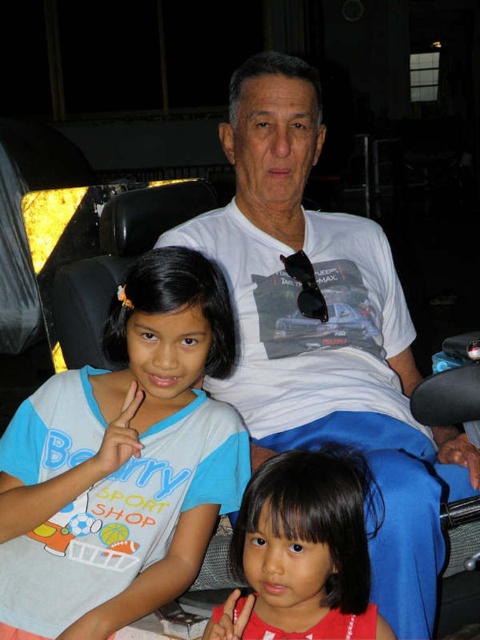
Can you confirm if white cotton t-shirt at center is smaller than blue cotton shirt at left?

No.

Who is lower down, white cotton t-shirt at center or blue cotton shirt at left?

Positioned lower is blue cotton shirt at left.

Who is more distant from viewer, (277, 440) or (159, 349)?

Point (277, 440)

Image resolution: width=480 pixels, height=640 pixels. Find the location of `white cotton t-shirt at center`. white cotton t-shirt at center is located at coordinates (326, 332).

Can you confirm if white cotton t-shirt at center is thinner than smooth red shirt at lower center?

No, white cotton t-shirt at center is not thinner than smooth red shirt at lower center.

Does point (373, 349) lie in front of point (243, 625)?

No, (373, 349) is further to viewer.

Locate an element on the screen. The height and width of the screenshot is (640, 480). white cotton t-shirt at center is located at coordinates click(x=326, y=332).

What are the coordinates of `blue cotton shirt at left` in the screenshot? It's located at (123, 461).

Measure the distance from blue cotton shirt at left to smooth red shirt at lower center.

A distance of 30.21 centimeters exists between blue cotton shirt at left and smooth red shirt at lower center.

Who is more forward, (168, 317) or (373, 634)?

Point (373, 634)

I want to click on blue cotton shirt at left, so click(x=123, y=461).